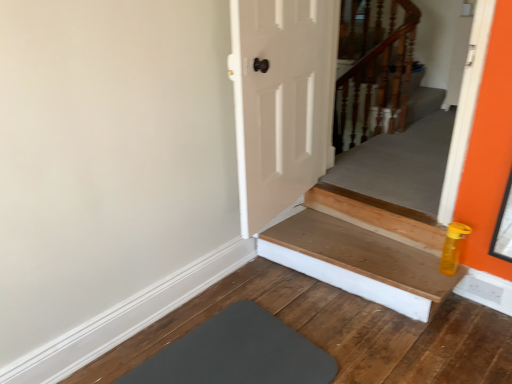
Question: Is gray rubber mat at lower left at the left side of wooden at upper right?

Choices:
 (A) no
 (B) yes

Answer: (B)

Question: Is gray rubber mat at lower left further to camera compared to wooden at upper right?

Choices:
 (A) no
 (B) yes

Answer: (A)

Question: Is gray rubber mat at lower left directly adjacent to wooden at upper right?

Choices:
 (A) no
 (B) yes

Answer: (A)

Question: Does gray rubber mat at lower left turn towards wooden at upper right?

Choices:
 (A) yes
 (B) no

Answer: (B)

Question: Does gray rubber mat at lower left have a lesser height compared to wooden at upper right?

Choices:
 (A) no
 (B) yes

Answer: (B)

Question: From a real-world perspective, is gray rubber mat at lower left beneath wooden at upper right?

Choices:
 (A) no
 (B) yes

Answer: (B)

Question: Is gray rubber mat at lower left bigger than wooden at bottom?

Choices:
 (A) yes
 (B) no

Answer: (B)

Question: From a real-world perspective, is gray rubber mat at lower left positioned under wooden at bottom based on gravity?

Choices:
 (A) yes
 (B) no

Answer: (A)

Question: Considering the relative sizes of gray rubber mat at lower left and wooden at bottom in the image provided, is gray rubber mat at lower left thinner than wooden at bottom?

Choices:
 (A) no
 (B) yes

Answer: (A)

Question: Does gray rubber mat at lower left have a lesser height compared to wooden at bottom?

Choices:
 (A) no
 (B) yes

Answer: (B)

Question: Does gray rubber mat at lower left appear on the left side of wooden at bottom?

Choices:
 (A) no
 (B) yes

Answer: (B)

Question: From the image's perspective, is gray rubber mat at lower left on wooden at bottom?

Choices:
 (A) no
 (B) yes

Answer: (A)

Question: Can you confirm if wooden at bottom is wider than gray rubber mat at lower left?

Choices:
 (A) no
 (B) yes

Answer: (A)